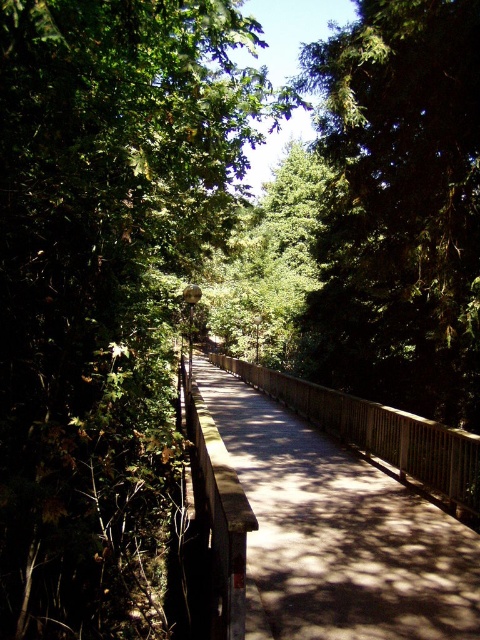
You are standing at point (x=335, y=563) and want to walk to point (x=242, y=172). Given the path is straight and the points are along it, will you be moving forward or backward?

Since point (x=242, y=172) is behind point (x=335, y=563), you will be moving backward to reach it.

You are standing at the start of the wooden path and want to reach the green leafy tree at center. Which direction should you walk to get there?

The green leafy tree at center is located at point (105,285), so you should walk forward along the path towards the center to reach it.